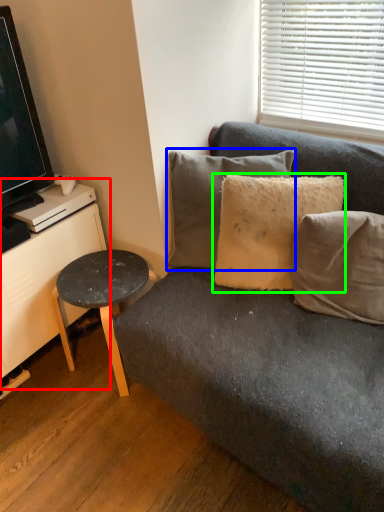
Question: Based on their relative distances, which object is nearer to dresser (highlighted by a red box)? Choose from pillow (highlighted by a blue box) and pillow (highlighted by a green box).

Choices:
 (A) pillow
 (B) pillow

Answer: (A)